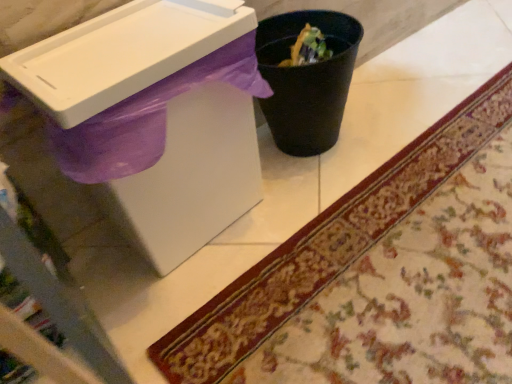
Find the location of a particular element. This screenshot has width=512, height=384. free location in front of white plastic sink at upper left is located at coordinates (226, 300).